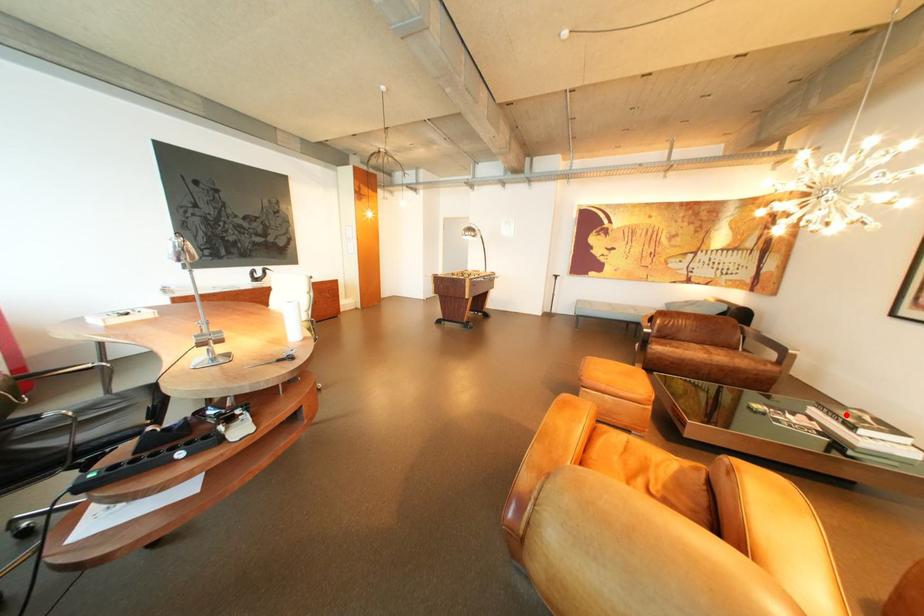
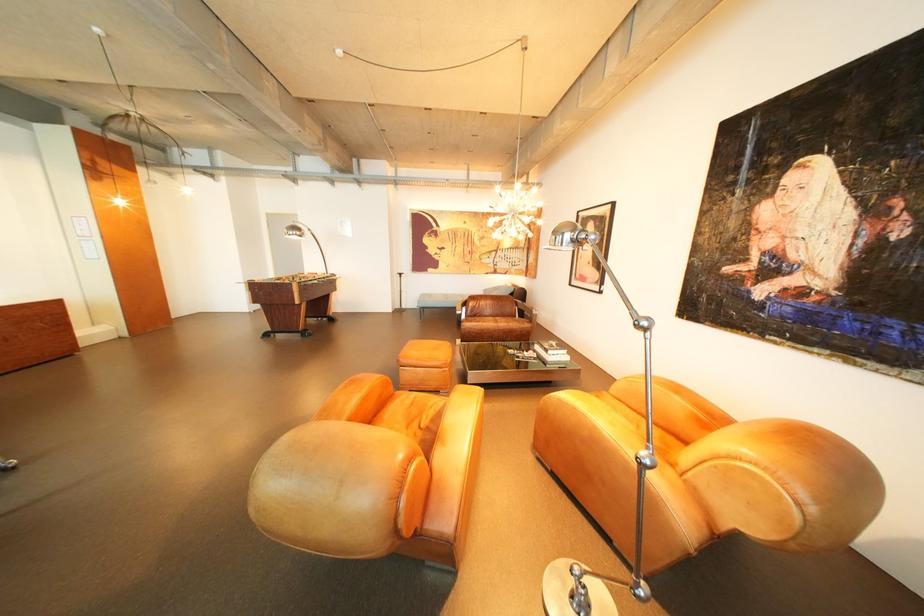
Locate, in the second image, the point that corresponds to the highlighted location in the first image.

(554, 347)